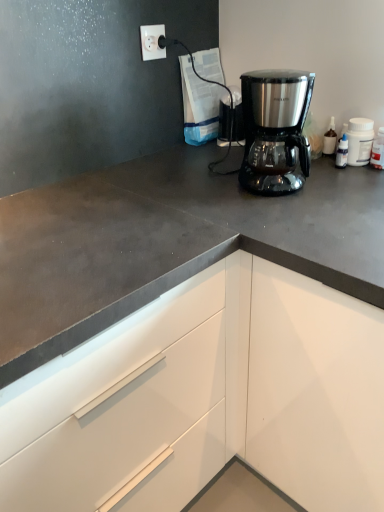
The height and width of the screenshot is (512, 384). What do you see at coordinates (152, 42) in the screenshot?
I see `white plastic socket at upper left` at bounding box center [152, 42].

At what (x,y) coordinates should I click in order to perform the action: click on stainless steel coffee maker at center. Please return your answer as a coordinate pair (x, y). Image resolution: width=384 pixels, height=512 pixels. Looking at the image, I should click on coord(275,130).

Locate an element on the screen. This screenshot has height=512, width=384. white plastic socket at upper left is located at coordinates (x=152, y=42).

Is white plastic bottle at upper right not near white plastic socket at upper left?

They are positioned close to each other.

Is point (373, 155) positioned before point (152, 46)?

Yes, it is in front of point (152, 46).

The height and width of the screenshot is (512, 384). I want to click on electric outlet located on the left of white plastic bottle at upper right, so click(152, 42).

Considering their positions, is white plastic socket at upper left located in front of or behind stainless steel coffee maker at center?

white plastic socket at upper left is behind stainless steel coffee maker at center.

Can you confirm if white plastic socket at upper left is shorter than stainless steel coffee maker at center?

Yes, white plastic socket at upper left is shorter than stainless steel coffee maker at center.

From the image's perspective, is white plastic socket at upper left over stainless steel coffee maker at center?

Indeed, from the image's perspective, white plastic socket at upper left is shown above stainless steel coffee maker at center.

Which is in front, point (151, 31) or point (293, 109)?

The point (293, 109) is closer to the camera.

From the image's perspective, is white plastic socket at upper left on top of white plastic bottle at upper right?

Indeed, from the image's perspective, white plastic socket at upper left is shown above white plastic bottle at upper right.

Considering the points (147, 52) and (383, 166), which point is in front, point (147, 52) or point (383, 166)?

The point (383, 166) is closer to the camera.

Would you say white plastic socket at upper left is inside or outside white plastic bottle at upper right?

white plastic socket at upper left is outside white plastic bottle at upper right.

From a real-world perspective, who is located lower, white plastic socket at upper left or white plastic bottle at upper right?

white plastic bottle at upper right is physically lower.

Is white plastic bottle at upper right directly adjacent to stainless steel coffee maker at center?

No, white plastic bottle at upper right is not touching stainless steel coffee maker at center.

Is the position of white plastic bottle at upper right more distant than that of stainless steel coffee maker at center?

Yes, the depth of white plastic bottle at upper right is greater than that of stainless steel coffee maker at center.

From the image's perspective, relative to stainless steel coffee maker at center, is white plastic bottle at upper right above or below?

white plastic bottle at upper right is situated higher than stainless steel coffee maker at center in the image.

What's the angular difference between white plastic bottle at upper right and stainless steel coffee maker at center's facing directions?

white plastic bottle at upper right and stainless steel coffee maker at center are facing 18.6 degrees away from each other.

Where is `bottle lying behind the stainless steel coffee maker at center`? bottle lying behind the stainless steel coffee maker at center is located at coordinates (378, 150).

Considering the positions of objects stainless steel coffee maker at center and white plastic bottle at upper right in the image provided, who is more to the right, stainless steel coffee maker at center or white plastic bottle at upper right?

From the viewer's perspective, white plastic bottle at upper right appears more on the right side.

Is stainless steel coffee maker at center not close to white plastic bottle at upper right?

They are positioned close to each other.

From the image's perspective, is stainless steel coffee maker at center located above or below white plastic socket at upper left?

Based on their image positions, stainless steel coffee maker at center is located beneath white plastic socket at upper left.

Is stainless steel coffee maker at center positioned far away from white plastic socket at upper left?

No, stainless steel coffee maker at center is not far from white plastic socket at upper left.

You are a GUI agent. You are given a task and a screenshot of the screen. Output one action in this format:
    pyautogui.click(x=<x>, y=<y>)
    Task: Click on the electric outlet lying on the left of stainless steel coffee maker at center
    The width and height of the screenshot is (384, 512).
    Given the screenshot: What is the action you would take?
    pyautogui.click(x=152, y=42)

You are a GUI agent. You are given a task and a screenshot of the screen. Output one action in this format:
    pyautogui.click(x=<x>, y=<y>)
    Task: Click on the electric outlet above the white plastic bottle at upper right (from the image's perspective)
    
    Given the screenshot: What is the action you would take?
    pyautogui.click(x=152, y=42)

At what (x,y) coordinates should I click in order to perform the action: click on electric outlet behind the stainless steel coffee maker at center. Please return your answer as a coordinate pair (x, y). Looking at the image, I should click on (152, 42).

From the image, which object appears to be farther from white plastic socket at upper left, stainless steel coffee maker at center or white plastic bottle at upper right?

white plastic bottle at upper right is further to white plastic socket at upper left.

Looking at the image, which one is located further to white plastic bottle at upper right, white plastic socket at upper left or stainless steel coffee maker at center?

white plastic socket at upper left lies further to white plastic bottle at upper right than the other object.

Estimate the real-world distances between objects in this image. Which object is closer to white plastic socket at upper left, white plastic bottle at upper right or stainless steel coffee maker at center?

stainless steel coffee maker at center is closer to white plastic socket at upper left.

Looking at the image, which one is located closer to stainless steel coffee maker at center, white plastic bottle at upper right or white plastic socket at upper left?

Among the two, white plastic bottle at upper right is located nearer to stainless steel coffee maker at center.

Considering their positions, is white plastic socket at upper left positioned closer to stainless steel coffee maker at center than white plastic bottle at upper right?

white plastic bottle at upper right.

Considering their positions, is stainless steel coffee maker at center positioned further to white plastic bottle at upper right than white plastic socket at upper left?

white plastic socket at upper left is positioned further to the anchor white plastic bottle at upper right.

The width and height of the screenshot is (384, 512). What are the coordinates of `coffee maker located between white plastic socket at upper left and white plastic bottle at upper right in the left-right direction` in the screenshot? It's located at (275, 130).